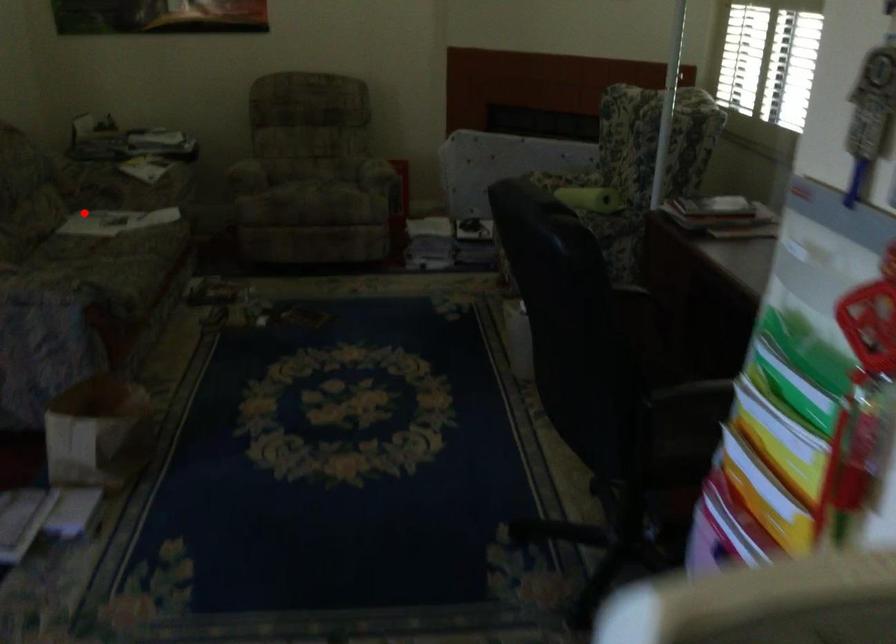
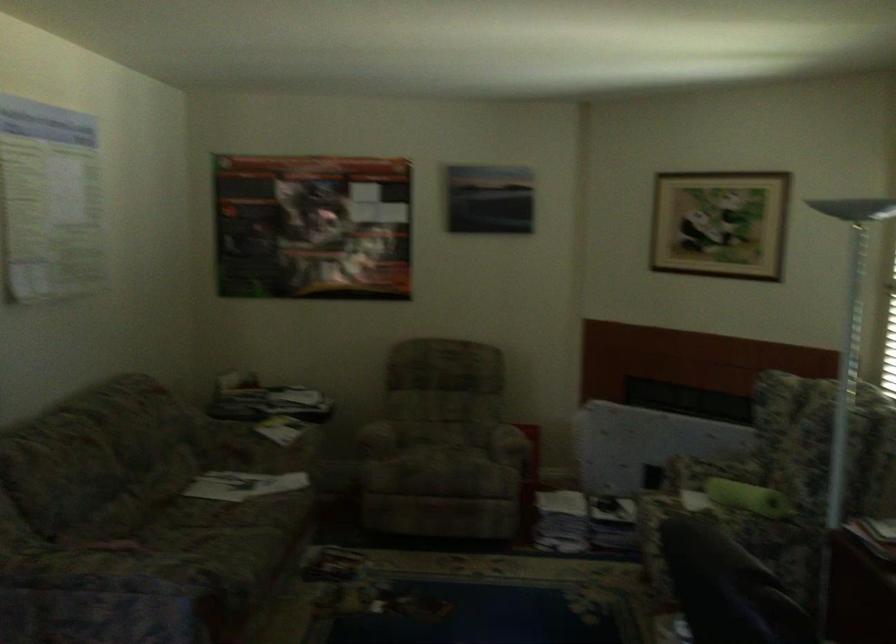
Locate, in the second image, the point that corresponds to the highlighted location in the first image.

(217, 488)